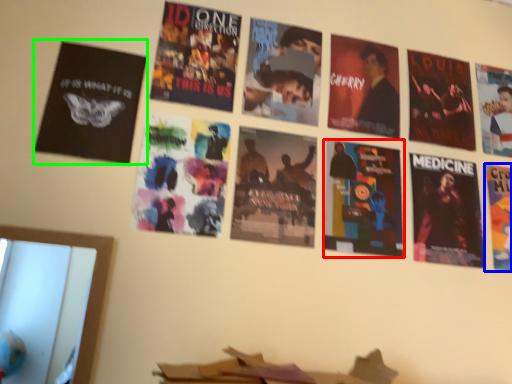
Question: Considering the real-world distances, which object is closest to poster (highlighted by a red box)? poster (highlighted by a blue box) or poster (highlighted by a green box).

Choices:
 (A) poster
 (B) poster

Answer: (A)